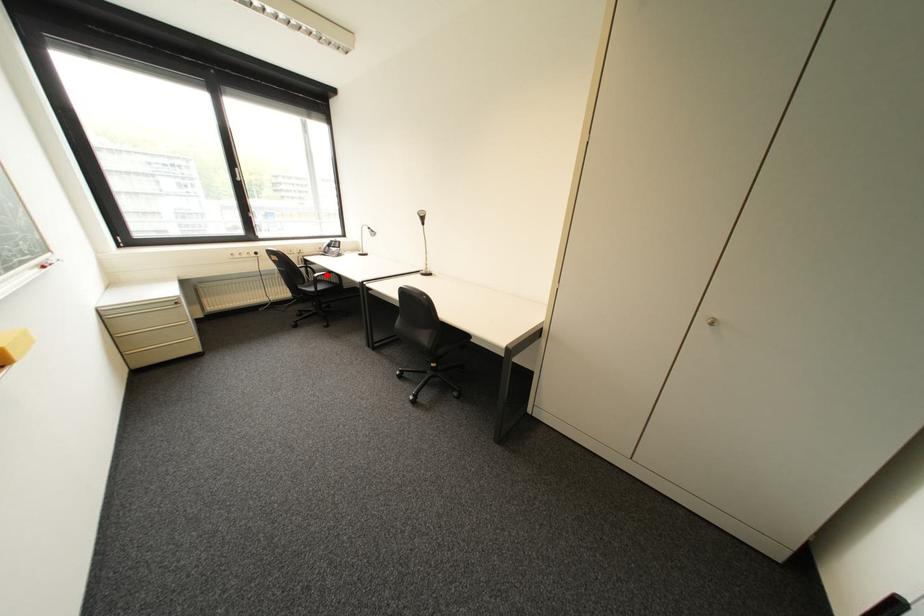
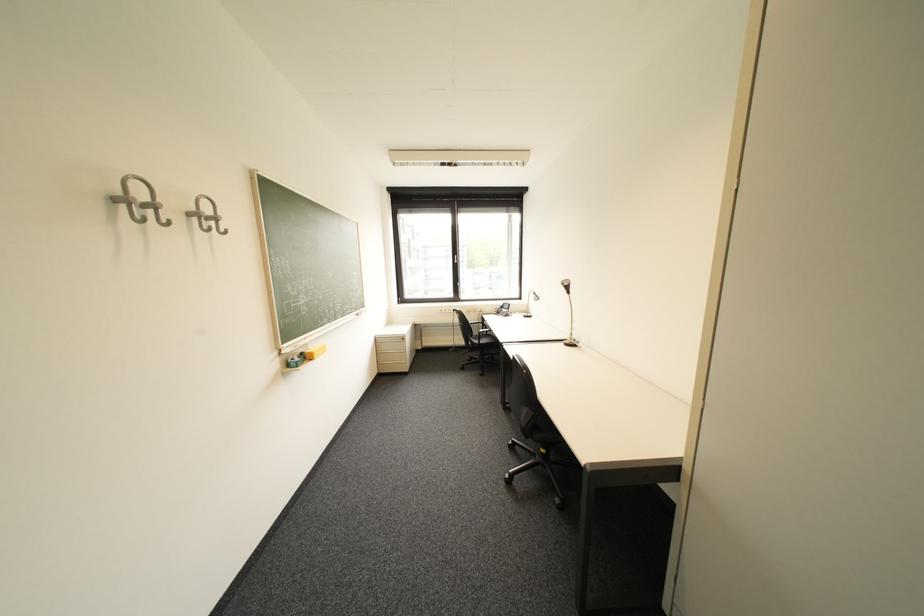
Find the pixel in the second image that matches the highlighted location in the first image.

(492, 331)